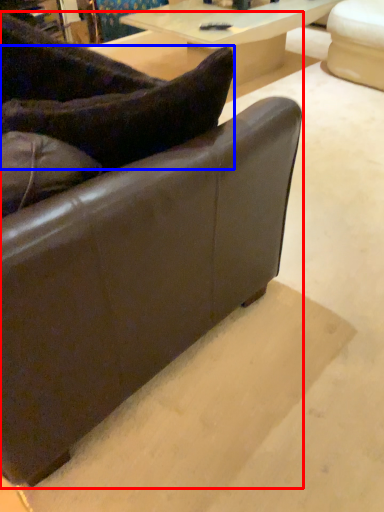
Question: Which point is further to the camera, studio couch (highlighted by a red box) or pillow (highlighted by a blue box)?

Choices:
 (A) studio couch
 (B) pillow

Answer: (B)